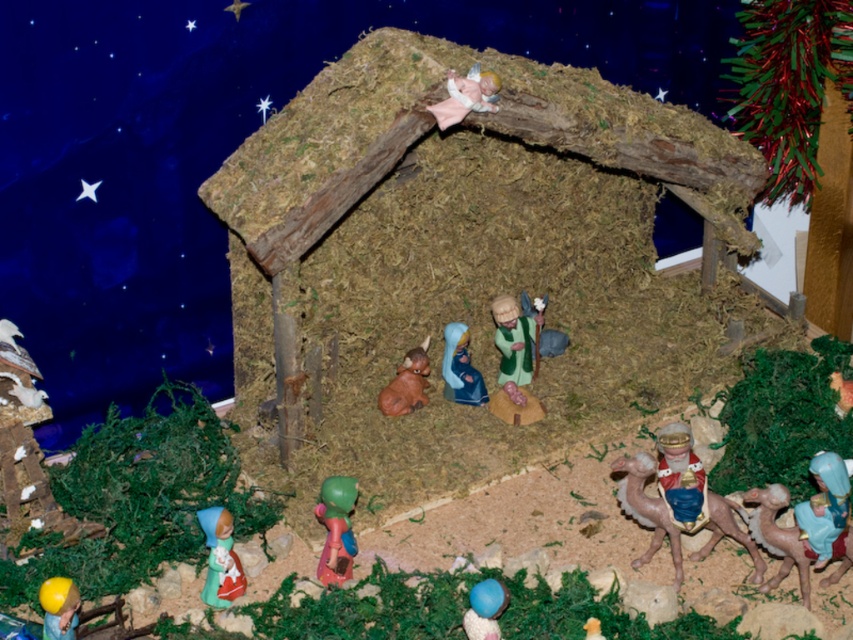
Does matte green plastic toy at lower center appear over yellow rubber ball at lower left?

Yes, matte green plastic toy at lower center is above yellow rubber ball at lower left.

Between matte green plastic toy at lower center and yellow rubber ball at lower left, which one is positioned higher?

Positioned higher is matte green plastic toy at lower center.

Does point (328, 548) come closer to viewer compared to point (61, 627)?

No, (328, 548) is further to viewer.

Identify the location of matte green plastic toy at lower center. The height and width of the screenshot is (640, 853). (335, 529).

In the scene shown: Does light brown matte camel at lower right appear over smooth plastic baby at center?

No.

Which is above, light brown matte camel at lower right or smooth plastic baby at center?

smooth plastic baby at center is higher up.

Is point (788, 544) positioned after point (468, 390)?

No, (788, 544) is in front of (468, 390).

You are a GUI agent. You are given a task and a screenshot of the screen. Output one action in this format:
    pyautogui.click(x=<x>, y=<y>)
    Task: Click on the light brown matte camel at lower right
    This screenshot has height=640, width=853.
    Given the screenshot: What is the action you would take?
    pyautogui.click(x=778, y=536)

Does brown matte cow at center have a smaller size compared to yellow rubber ball at lower left?

Actually, brown matte cow at center might be larger than yellow rubber ball at lower left.

Is point (422, 396) positioned behind point (71, 598)?

Yes, point (422, 396) is behind point (71, 598).

Where is `brown matte cow at center`? The height and width of the screenshot is (640, 853). brown matte cow at center is located at coordinates (405, 384).